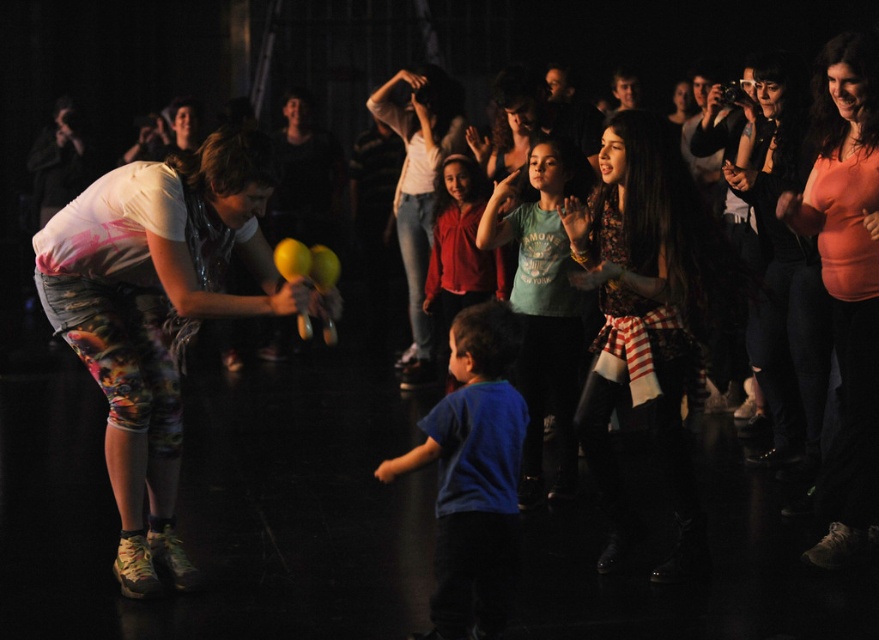
Question: Which point is closer to the camera?

Choices:
 (A) matte red shirt at center
 (B) printed leggings at left
 (C) matte pink shirt at upper right
 (D) black matte jacket at upper left

Answer: (B)

Question: Is green matte shirt at center smaller than black matte jacket at upper left?

Choices:
 (A) no
 (B) yes

Answer: (A)

Question: Which point is farther to the camera?

Choices:
 (A) orange matte shirt at upper right
 (B) black matte jacket at upper left
 (C) green matte shirt at center
 (D) printed leggings at left

Answer: (B)

Question: Does green matte shirt at center have a smaller size compared to matte red shirt at center?

Choices:
 (A) no
 (B) yes

Answer: (B)

Question: Among these points, which one is nearest to the camera?

Choices:
 (A) (442, 365)
 (B) (52, 186)

Answer: (A)

Question: Can you confirm if matte pink shirt at upper right is bigger than matte red shirt at center?

Choices:
 (A) no
 (B) yes

Answer: (A)